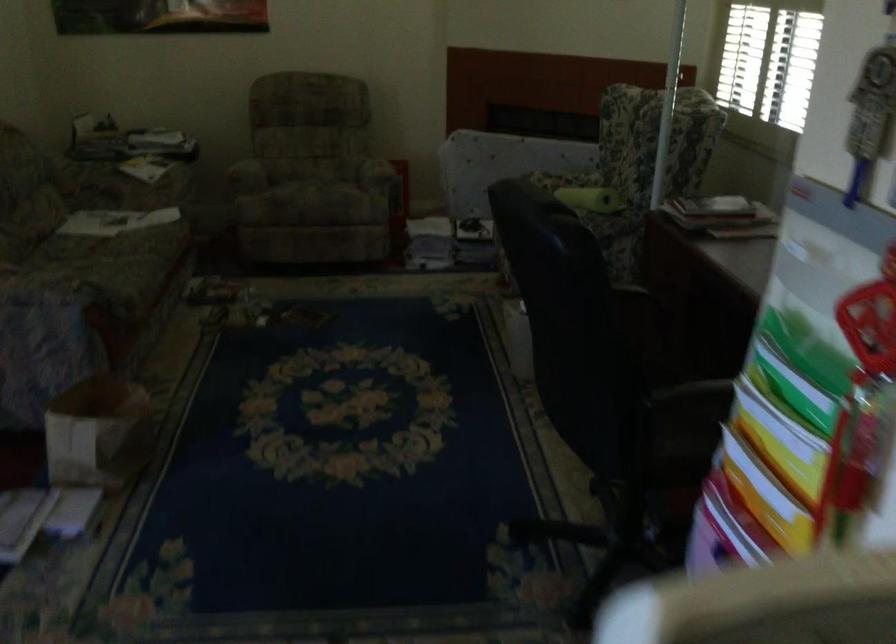
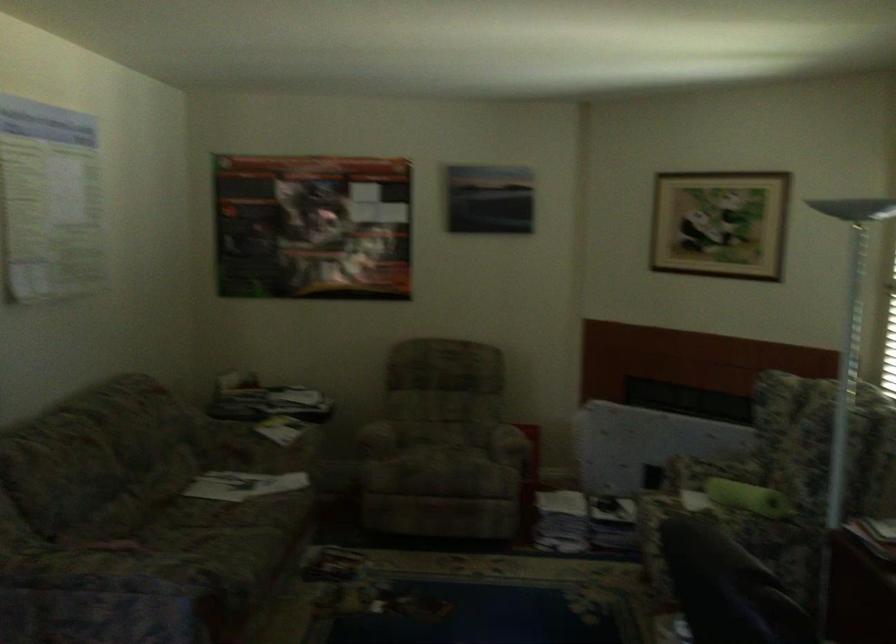
Where in the second image is the point corresponding to point (586, 202) from the first image?

(748, 498)